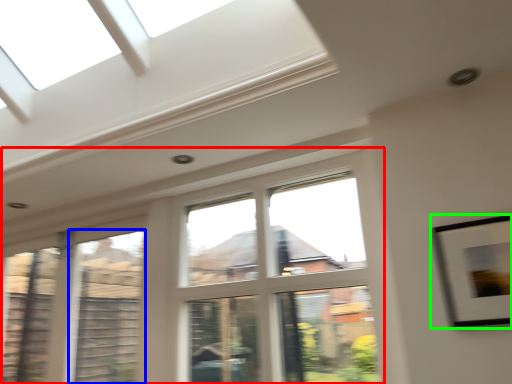
Question: Based on their relative distances, which object is nearer to window (highlighted by a red box)? Choose from window (highlighted by a blue box) and picture frame (highlighted by a green box).

Choices:
 (A) window
 (B) picture frame

Answer: (A)